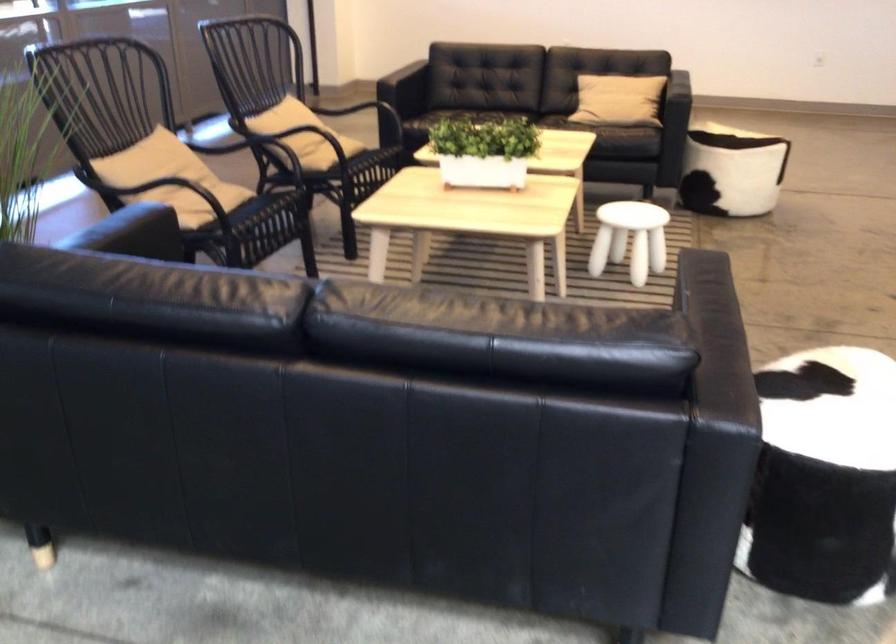
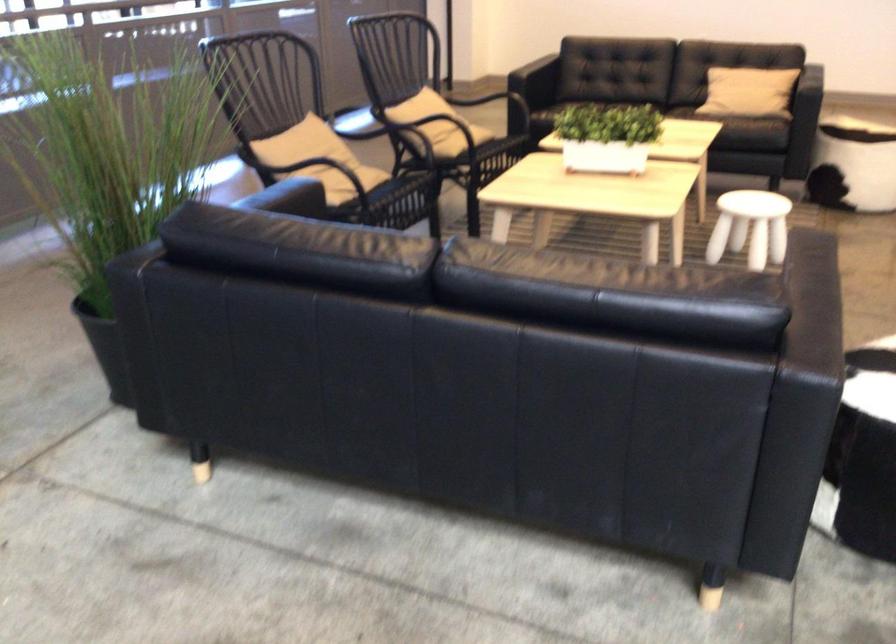
Find the pixel in the second image that matches the point at 326,156 in the first image.

(462, 140)